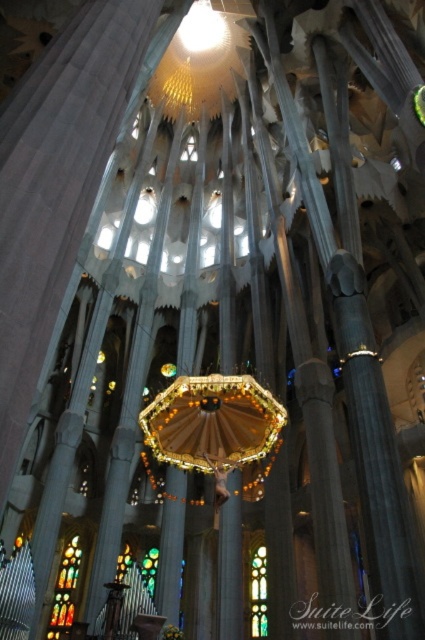
Does point (59, 579) come behind point (265, 568)?

No, (59, 579) is in front of (265, 568).

Which is in front, point (73, 557) or point (255, 580)?

Point (255, 580) is more forward.

Measure the distance between stained glass window at lower left and camera.

They are 95.08 meters apart.

The height and width of the screenshot is (640, 425). Find the location of `stained glass window at lower left`. stained glass window at lower left is located at coordinates (65, 589).